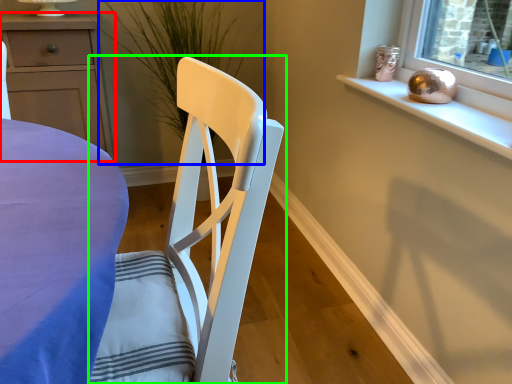
Question: Considering the real-world distances, which object is farthest from cabinetry (highlighted by a red box)? plant (highlighted by a blue box) or chair (highlighted by a green box)?

Choices:
 (A) plant
 (B) chair

Answer: (B)